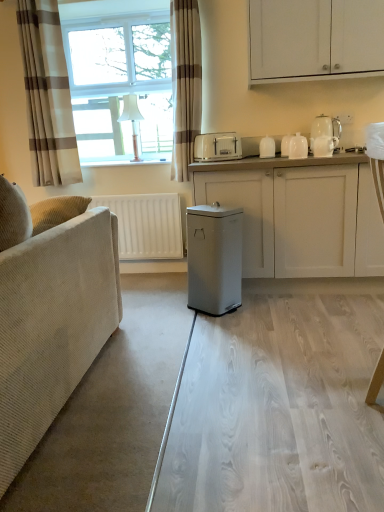
You are a GUI agent. You are given a task and a screenshot of the screen. Output one action in this format:
    pyautogui.click(x=<x>, y=<y>)
    Task: Click on the vacant space in front of metallic gray trash can at center
    
    Given the screenshot: What is the action you would take?
    click(220, 324)